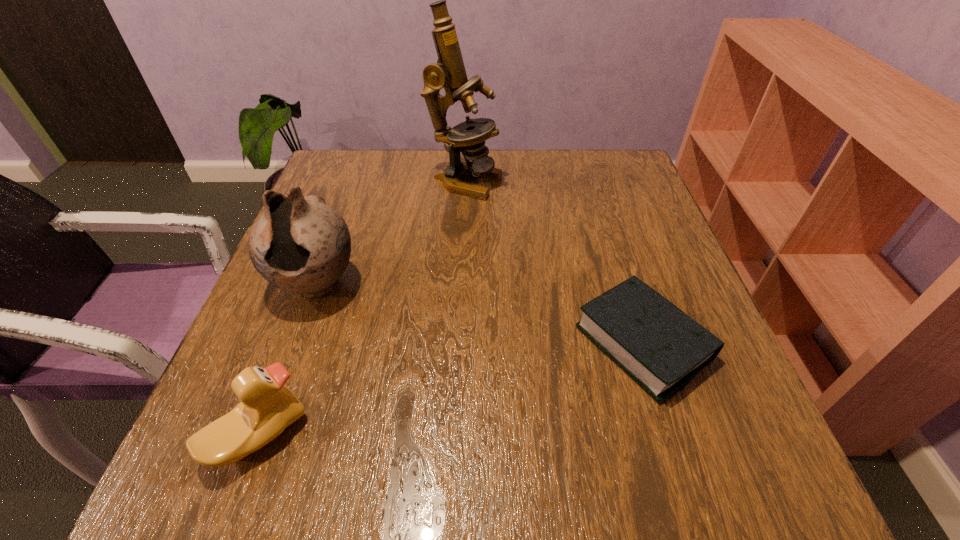
I want to click on free space at the far left corner, so click(388, 160).

Locate an element on the screen. vacant region at the near left corner of the desktop is located at coordinates (250, 461).

This screenshot has height=540, width=960. Find the location of `vacant space at the near right corner of the desktop`. vacant space at the near right corner of the desktop is located at coordinates (661, 463).

This screenshot has width=960, height=540. I want to click on vacant space in between the third tallest object and the tallest object, so click(x=362, y=308).

Find the location of `free space between the second object from right to left and the second shortest object`. free space between the second object from right to left and the second shortest object is located at coordinates (362, 308).

Find the location of a particular element. The height and width of the screenshot is (540, 960). vacant space in between the second tallest object and the rightmost object is located at coordinates (480, 314).

Find the location of `vacant area that lies between the farthest object and the shortest object`. vacant area that lies between the farthest object and the shortest object is located at coordinates (554, 262).

At what (x,y) coordinates should I click in order to perform the action: click on vacant space that's between the shortest object and the third shortest object. Please return your answer as a coordinate pair (x, y). Image resolution: width=960 pixels, height=540 pixels. Looking at the image, I should click on (480, 314).

Where is `vacant area that lies between the microscope and the third tallest object`? vacant area that lies between the microscope and the third tallest object is located at coordinates (362, 308).

The width and height of the screenshot is (960, 540). I want to click on blank region between the second tallest object and the shortest object, so [480, 314].